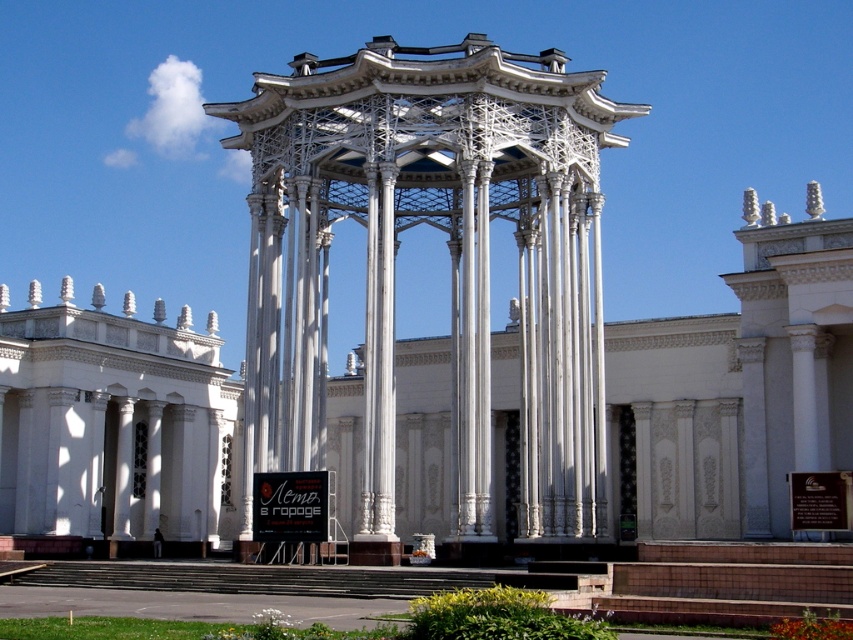
Question: Is white marble columns at center smaller than white metallic gazebo at center?

Choices:
 (A) yes
 (B) no

Answer: (B)

Question: Can you confirm if white marble columns at center is wider than white metallic gazebo at center?

Choices:
 (A) no
 (B) yes

Answer: (B)

Question: Is white marble columns at center above white metallic gazebo at center?

Choices:
 (A) no
 (B) yes

Answer: (A)

Question: Among these points, which one is nearest to the camera?

Choices:
 (A) (817, 252)
 (B) (526, 134)

Answer: (A)